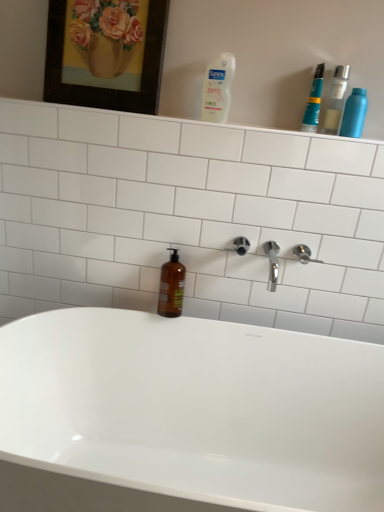
Question: Is white glossy bathtub at center completely or partially inside white plastic bottle at upper center, which is the second cleaning product in right-to-left order?

Choices:
 (A) yes
 (B) no

Answer: (B)

Question: From the image's perspective, is white plastic bottle at upper center, which is the 1th cleaning product from left to right, above white glossy bathtub at center?

Choices:
 (A) yes
 (B) no

Answer: (A)

Question: Can you confirm if white plastic bottle at upper center, which is the second cleaning product in right-to-left order, is wider than white glossy bathtub at center?

Choices:
 (A) yes
 (B) no

Answer: (B)

Question: Considering the relative positions of white plastic bottle at upper center, which is the 1th cleaning product from left to right, and white glossy bathtub at center in the image provided, is white plastic bottle at upper center, which is the 1th cleaning product from left to right, behind white glossy bathtub at center?

Choices:
 (A) yes
 (B) no

Answer: (A)

Question: Are white plastic bottle at upper center, which is the 1th cleaning product from left to right, and white glossy bathtub at center located far from each other?

Choices:
 (A) no
 (B) yes

Answer: (A)

Question: From the image's perspective, is white plastic bottle at upper center, which is the 1th cleaning product from left to right, under white glossy bathtub at center?

Choices:
 (A) yes
 (B) no

Answer: (B)

Question: Considering the relative positions of metallic blue spray can at upper right, which is counted as the 1th cleaning product, starting from the right, and transparent plastic bottle at upper right, the first mouthwash from the right, in the image provided, is metallic blue spray can at upper right, which is counted as the 1th cleaning product, starting from the right, to the left of transparent plastic bottle at upper right, the first mouthwash from the right, from the viewer's perspective?

Choices:
 (A) no
 (B) yes

Answer: (A)

Question: From a real-world perspective, is metallic blue spray can at upper right, which is counted as the 1th cleaning product, starting from the right, located beneath transparent plastic bottle at upper right, the third mouthwash positioned from the left?

Choices:
 (A) no
 (B) yes

Answer: (B)

Question: Does metallic blue spray can at upper right, which is counted as the 1th cleaning product, starting from the right, appear on the right side of transparent plastic bottle at upper right, positioned as the second mouthwash in bottom-to-top order?

Choices:
 (A) yes
 (B) no

Answer: (A)

Question: Does metallic blue spray can at upper right, which is counted as the 1th cleaning product, starting from the right, turn towards transparent plastic bottle at upper right, the third mouthwash positioned from the left?

Choices:
 (A) no
 (B) yes

Answer: (A)

Question: Is metallic blue spray can at upper right, which is counted as the 1th cleaning product, starting from the right, beside transparent plastic bottle at upper right, positioned as the second mouthwash in bottom-to-top order?

Choices:
 (A) yes
 (B) no

Answer: (A)

Question: From the image's perspective, is metallic blue spray can at upper right, which is counted as the 1th cleaning product, starting from the right, located above transparent plastic bottle at upper right, the first mouthwash from the right?

Choices:
 (A) no
 (B) yes

Answer: (A)

Question: Considering the relative sizes of white plastic bottle at upper center, which is the 1th cleaning product from left to right, and metallic blue spray can at upper right, acting as the 2th cleaning product starting from the left, in the image provided, is white plastic bottle at upper center, which is the 1th cleaning product from left to right, bigger than metallic blue spray can at upper right, acting as the 2th cleaning product starting from the left,?

Choices:
 (A) no
 (B) yes

Answer: (B)